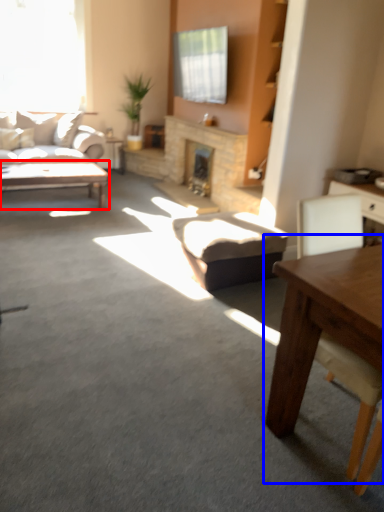
Question: Which object is further to the camera taking this photo, coffee table (highlighted by a red box) or table (highlighted by a blue box)?

Choices:
 (A) coffee table
 (B) table

Answer: (A)